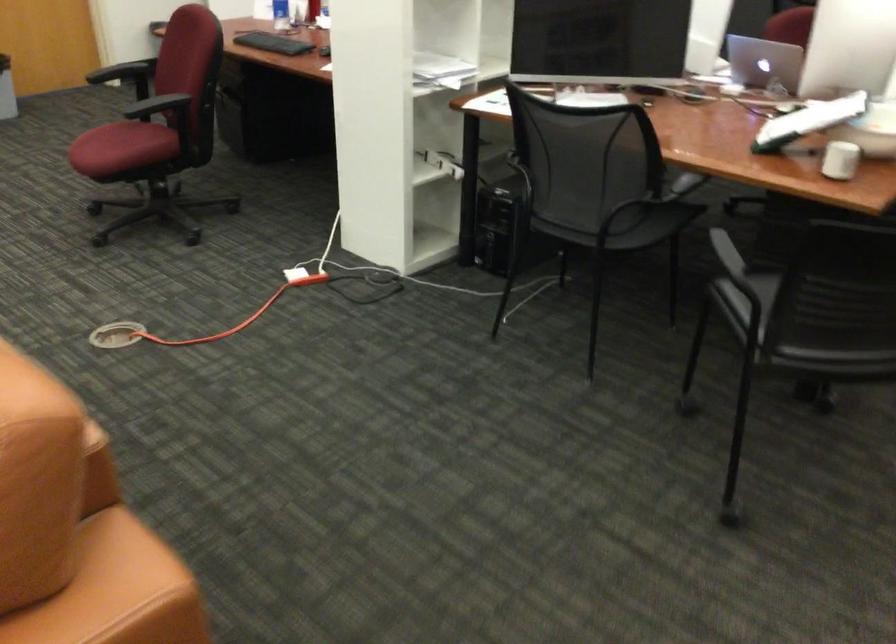
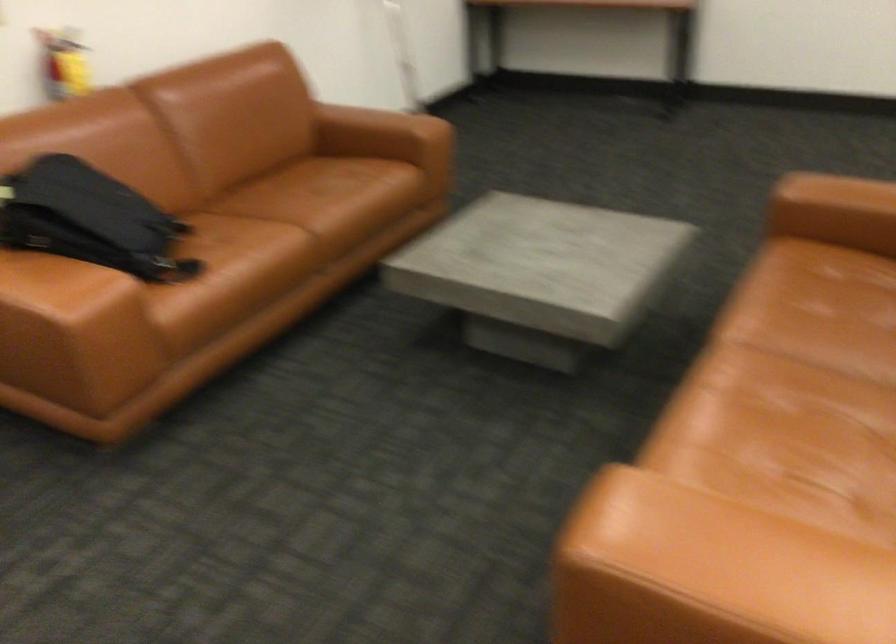
First-person continuous shooting, in which direction is the camera rotating?

The rotation direction of the camera is left-down.